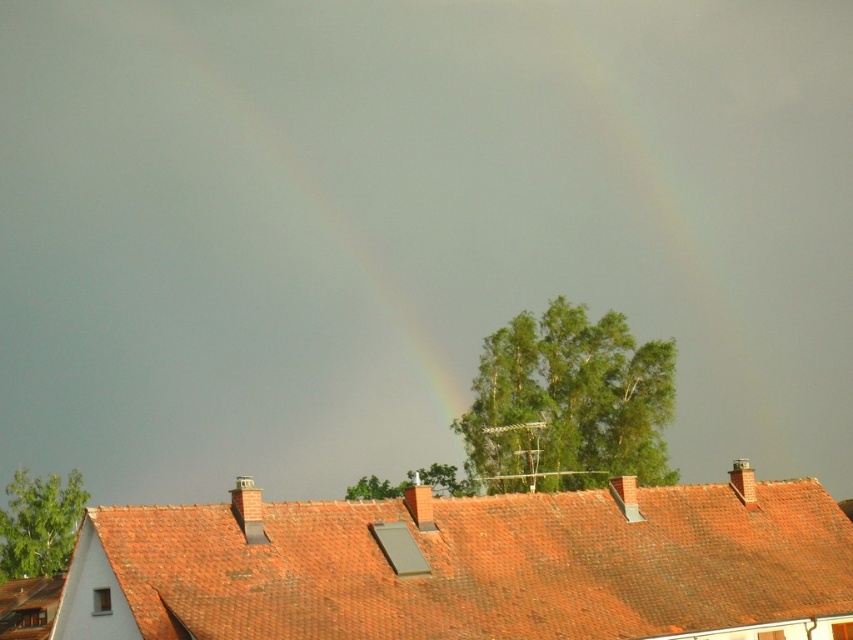
In the scene shown: You are a drone operator trying to capture a photo of the red tile roof at center and the rainbow at upper center. If you want to frame both in the same shot, which object should you adjust your camera angle to focus on first to ensure both fit?

The red tile roof at center has a lesser width compared to the rainbow at upper center. To ensure both fit in the frame, focus on capturing the wider rainbow at upper center first, then adjust to include the narrower red tile roof at center.

You are an architect designing a new residential area. You want to ensure that the new buildings do not block the view of the rainbow at upper center from the central courtyard. Given the current scene with the red tile roof at center, which structure takes up more visual space and might potentially obstruct the rainbow?

The rainbow at upper center occupies more space than the red tile roof at center, so the red tile roof at center is smaller and less likely to obstruct the rainbow. However, the architect should still consider the positioning to ensure the rainbow remains visible.

You are an architect designing a new house. You want to ensure that the red tile roof at center will not block the view of the rainbow at upper center from the living room window. Based on the scene, is this possible?

The red tile roof at center is located below the rainbow at upper center, so the rainbow at upper center would be visible above the roof. Therefore, the living room window can have an unobstructed view of the rainbow at upper center as long as it is positioned above the red tile roof at center.